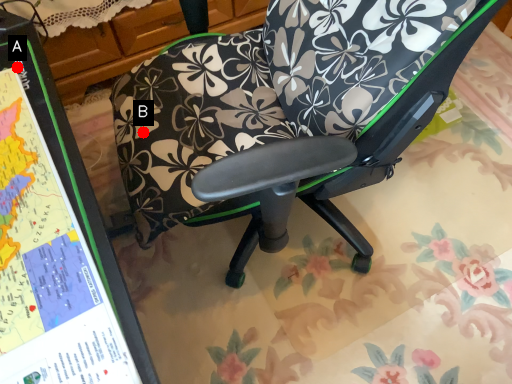
Question: Two points are circled on the image, labeled by A and B beside each circle. Which point is farther to the camera?

Choices:
 (A) A is further
 (B) B is further

Answer: (B)